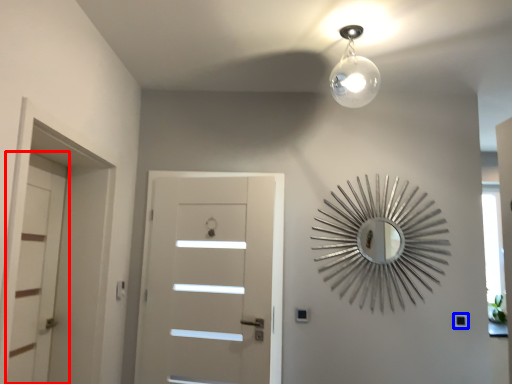
Question: Which of the following is the farthest to the observer, door (highlighted by a red box) or light switch (highlighted by a blue box)?

Choices:
 (A) door
 (B) light switch

Answer: (B)